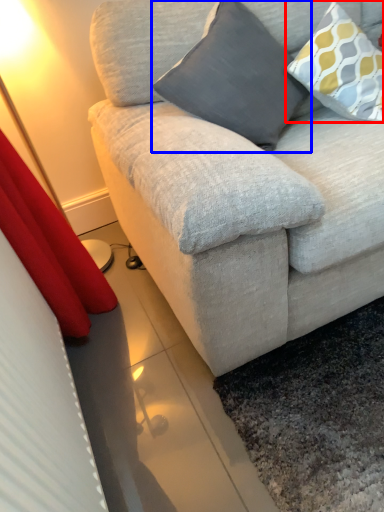
Question: Which of the following is the farthest to the observer, pillow (highlighted by a red box) or pillow (highlighted by a blue box)?

Choices:
 (A) pillow
 (B) pillow

Answer: (A)